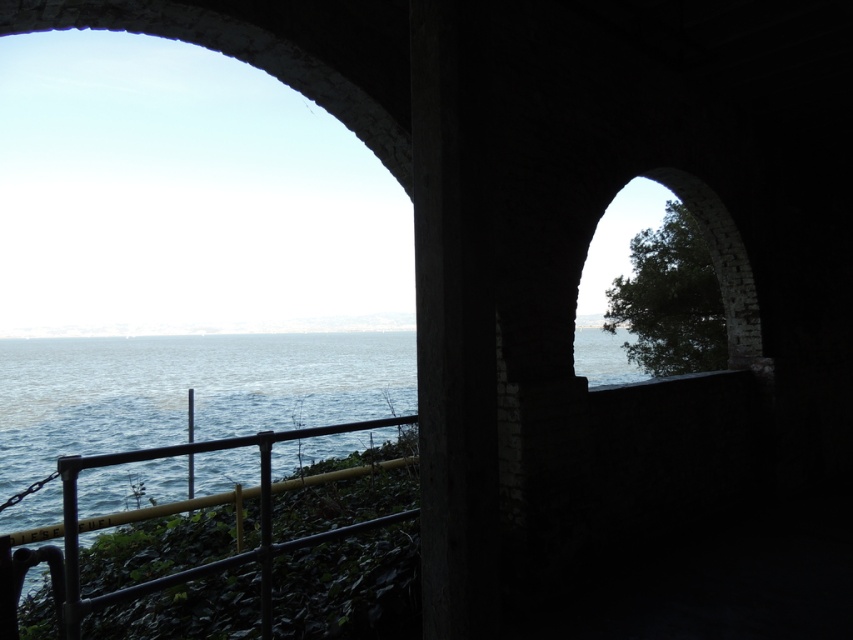
Question: Can you confirm if blue water at center is positioned to the right of black metal railing at lower left?

Choices:
 (A) no
 (B) yes

Answer: (A)

Question: Is blue water at center further to camera compared to black metal railing at lower left?

Choices:
 (A) no
 (B) yes

Answer: (B)

Question: Is blue water at center above black metal railing at lower left?

Choices:
 (A) no
 (B) yes

Answer: (A)

Question: Which point is closer to the camera?

Choices:
 (A) (106, 436)
 (B) (264, 564)

Answer: (B)